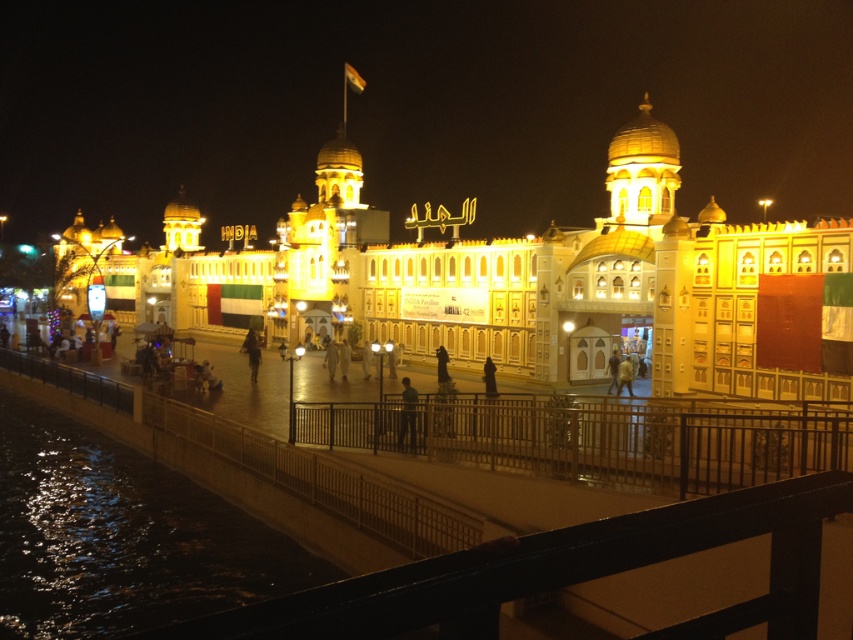
You are standing on the pedestrian walkway near the metal railing. There is a dark reflective water at lower left marked by point (120, 536). If you want to reach the building with the word INDIA displayed, should you walk towards or away from the dark reflective water at lower left?

Since the dark reflective water at lower left is located at point (120, 536), walking away from it would take you closer to the building with the word INDIA displayed. Therefore, you should walk away from the dark reflective water at lower left.